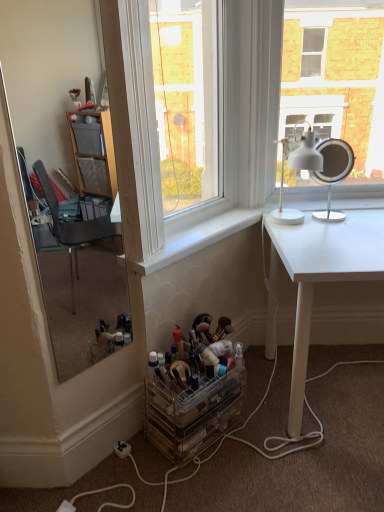
The width and height of the screenshot is (384, 512). Find the location of `vacant region to the right of white plastic table lamp at upper right, which is counted as the second table lamp, starting from the left`. vacant region to the right of white plastic table lamp at upper right, which is counted as the second table lamp, starting from the left is located at coordinates (362, 216).